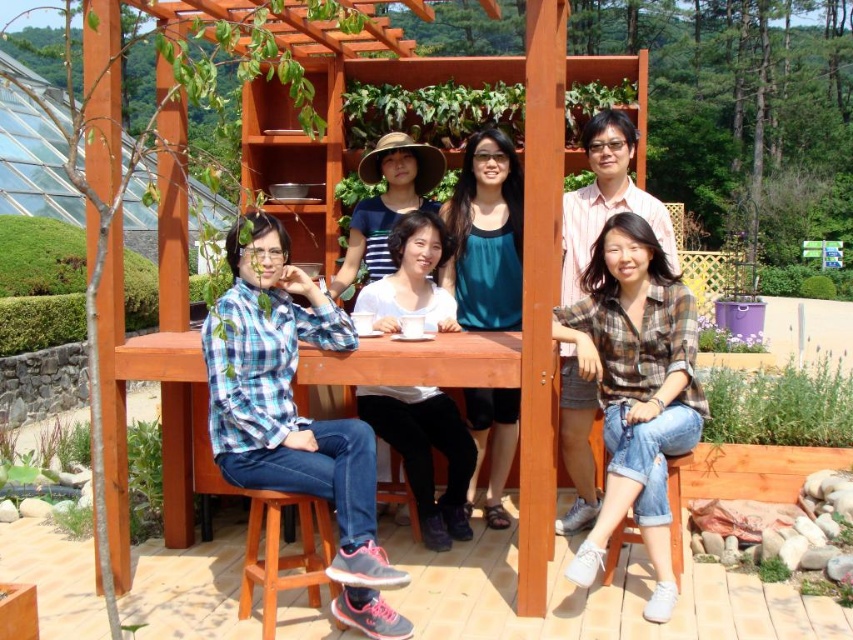
Question: Estimate the real-world distances between objects in this image. Which object is closer to the white matte shirt at center?

Choices:
 (A) wooden pergola at center
 (B) wooden stool at lower left
 (C) teal fabric top at center
 (D) plaid cotton shirt at center

Answer: (C)

Question: Which of the following is the closest to the observer?

Choices:
 (A) (422, 246)
 (B) (601, 253)
 (C) (270, 588)
 (D) (332, 97)

Answer: (C)

Question: Is plaid cotton shirt at center positioned at the back of teal fabric top at center?

Choices:
 (A) yes
 (B) no

Answer: (B)

Question: Among these objects, which one is nearest to the camera?

Choices:
 (A) wooden pergola at center
 (B) denim stool at lower right

Answer: (A)

Question: Can you confirm if teal fabric top at center is bigger than wooden stool at lower left?

Choices:
 (A) yes
 (B) no

Answer: (B)

Question: Does teal fabric top at center have a larger size compared to white matte shirt at center?

Choices:
 (A) yes
 (B) no

Answer: (B)